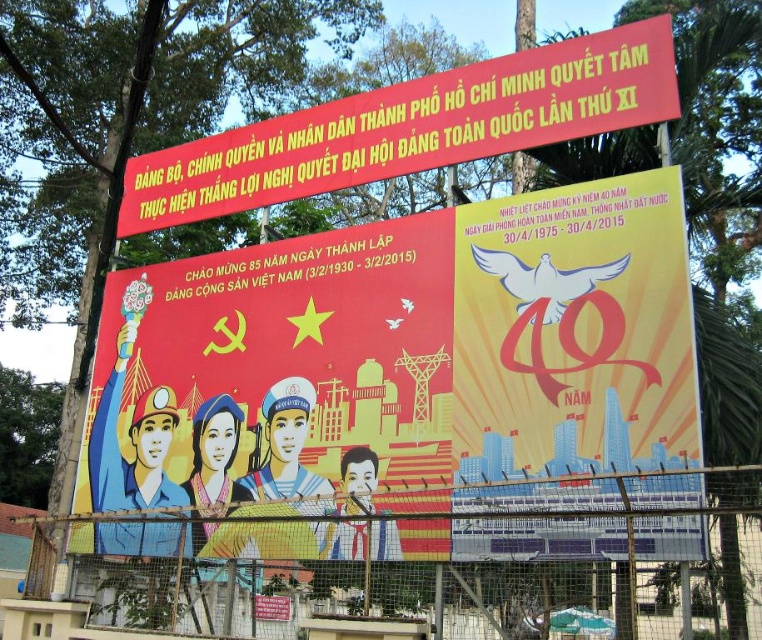
Question: Does metal wire mesh at lower center have a larger size compared to red banner at upper center?

Choices:
 (A) yes
 (B) no

Answer: (A)

Question: Among these points, which one is nearest to the camera?

Choices:
 (A) (578, 339)
 (B) (139, 228)

Answer: (A)

Question: Where is matte red poster at center located in relation to yellow paper poster at center in the image?

Choices:
 (A) below
 (B) above

Answer: (A)

Question: Which point is farther to the camera?

Choices:
 (A) red banner at upper center
 (B) matte red poster at center
 (C) yellow paper poster at center

Answer: (A)

Question: Can you confirm if yellow paper poster at center is positioned to the right of red banner at upper center?

Choices:
 (A) yes
 (B) no

Answer: (A)

Question: Which object is farther from the camera taking this photo?

Choices:
 (A) matte red poster at center
 (B) red banner at upper center

Answer: (B)